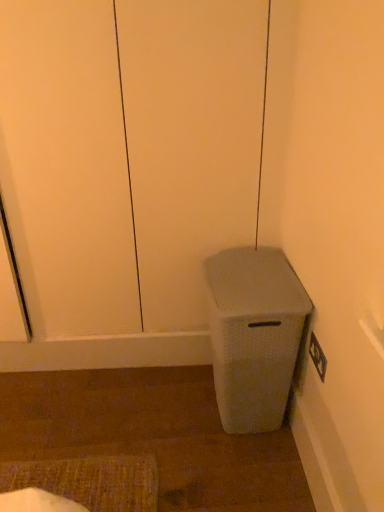
Question: Is white textured screen door at lower right facing away from white textured waste bin at lower right?

Choices:
 (A) no
 (B) yes

Answer: (B)

Question: Can white textured waste bin at lower right be found inside white textured screen door at lower right?

Choices:
 (A) yes
 (B) no

Answer: (B)

Question: Is white textured screen door at lower right positioned before white textured waste bin at lower right?

Choices:
 (A) yes
 (B) no

Answer: (A)

Question: Does white textured screen door at lower right have a greater width compared to white textured waste bin at lower right?

Choices:
 (A) yes
 (B) no

Answer: (B)

Question: Is white textured screen door at lower right smaller than white textured waste bin at lower right?

Choices:
 (A) yes
 (B) no

Answer: (B)

Question: Can you confirm if white textured screen door at lower right is shorter than white textured waste bin at lower right?

Choices:
 (A) yes
 (B) no

Answer: (B)

Question: Can you confirm if white textured waste bin at lower right is smaller than white textured screen door at lower right?

Choices:
 (A) yes
 (B) no

Answer: (A)

Question: Is white textured waste bin at lower right bigger than white textured screen door at lower right?

Choices:
 (A) yes
 (B) no

Answer: (B)

Question: Is white textured waste bin at lower right positioned before white textured screen door at lower right?

Choices:
 (A) no
 (B) yes

Answer: (A)

Question: Considering the relative sizes of white textured waste bin at lower right and white textured screen door at lower right in the image provided, is white textured waste bin at lower right shorter than white textured screen door at lower right?

Choices:
 (A) no
 (B) yes

Answer: (B)

Question: Is white textured waste bin at lower right outside of white textured screen door at lower right?

Choices:
 (A) no
 (B) yes

Answer: (B)

Question: Does white textured waste bin at lower right have a greater width compared to white textured screen door at lower right?

Choices:
 (A) no
 (B) yes

Answer: (B)

Question: Do you think white textured screen door at lower right is within white textured waste bin at lower right, or outside of it?

Choices:
 (A) outside
 (B) inside

Answer: (A)